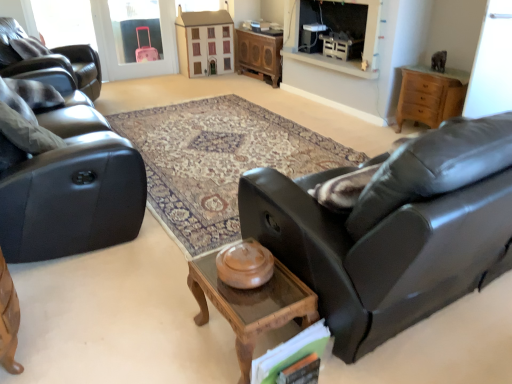
Locate an element on the screen. The width and height of the screenshot is (512, 384). vacant area on top of wooden glass coffee table at center (from a real-world perspective) is located at coordinates pos(242,284).